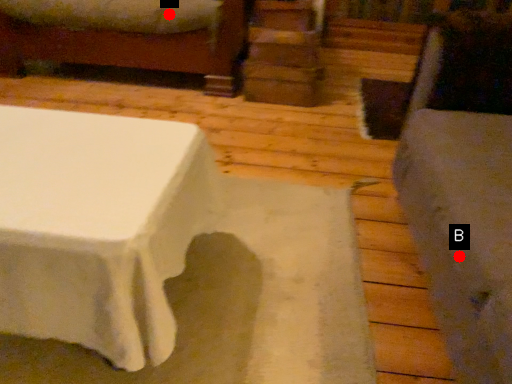
Question: Two points are circled on the image, labeled by A and B beside each circle. Which point appears closest to the camera in this image?

Choices:
 (A) A is closer
 (B) B is closer

Answer: (B)